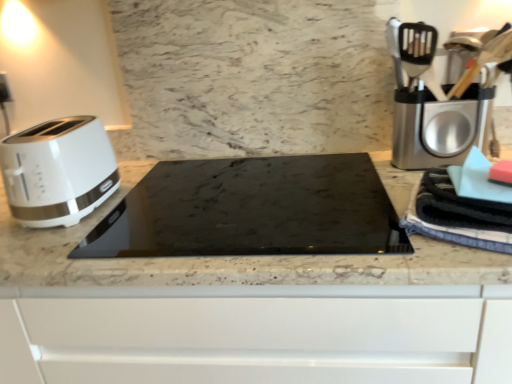
This screenshot has height=384, width=512. In order to click on free location in front of white glossy toaster at left in this screenshot , I will do `click(48, 248)`.